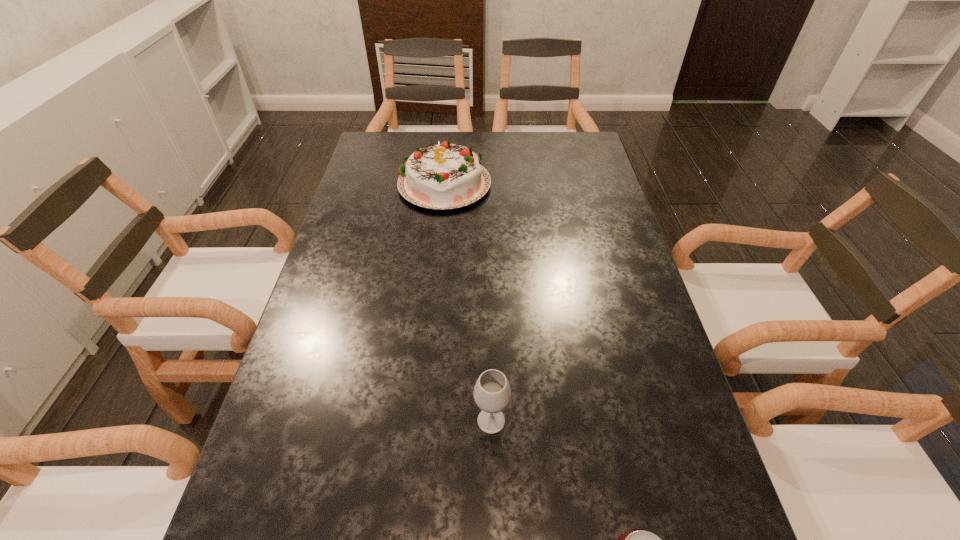
Where is `the farthest object`? Image resolution: width=960 pixels, height=540 pixels. the farthest object is located at coordinates (446, 176).

At what (x,y) coordinates should I click in order to perform the action: click on wineglass. Please return your answer as a coordinate pair (x, y). Looking at the image, I should click on (492, 393).

Identify the location of vacant space located on the left of the farthest object. The image size is (960, 540). (353, 184).

Image resolution: width=960 pixels, height=540 pixels. In order to click on vacant space located on the left of the wineglass in this screenshot , I will do `click(269, 421)`.

The height and width of the screenshot is (540, 960). What are the coordinates of `object at the far edge` in the screenshot? It's located at (446, 176).

Locate an element on the screen. The height and width of the screenshot is (540, 960). object that is at the left edge is located at coordinates (446, 176).

Image resolution: width=960 pixels, height=540 pixels. Find the location of `object positioned at the far left corner`. object positioned at the far left corner is located at coordinates (446, 176).

Where is `free spot at the far edge of the desktop`? This screenshot has width=960, height=540. free spot at the far edge of the desktop is located at coordinates [x=523, y=157].

Identify the location of free space at the left edge. The height and width of the screenshot is (540, 960). pyautogui.click(x=362, y=227).

You are a GUI agent. You are given a task and a screenshot of the screen. Output one action in this format:
    pyautogui.click(x=<x>, y=<y>)
    Task: Click on the vacant area at the right edge
    This screenshot has height=540, width=960.
    Given the screenshot: What is the action you would take?
    pyautogui.click(x=601, y=279)